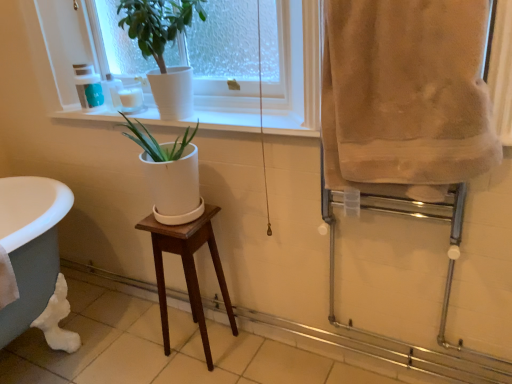
Locate an element on the screen. free space above white ceramic at upper center (from a real-world perspective) is located at coordinates (212, 120).